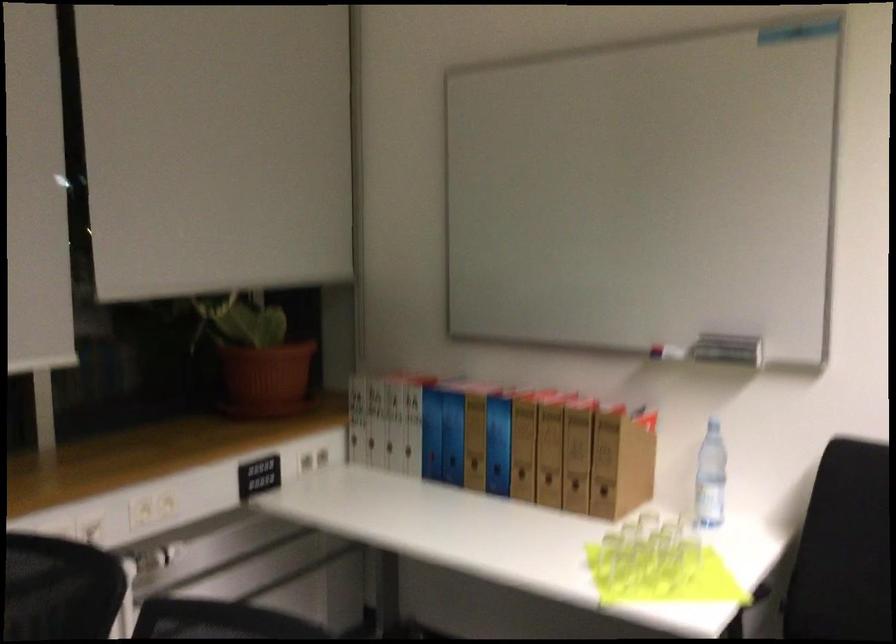
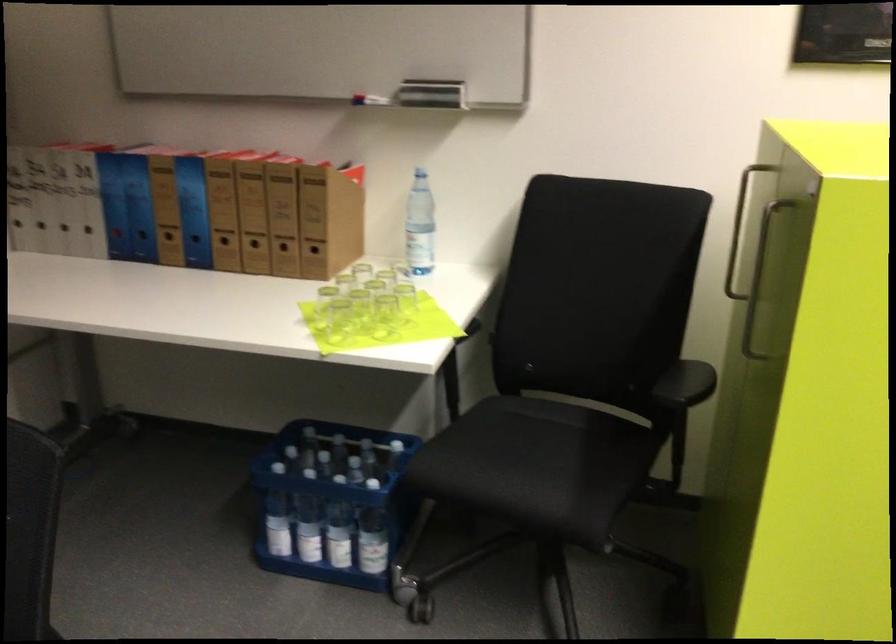
Find the pixel in the second image that matches point (675, 573) in the first image.

(383, 316)